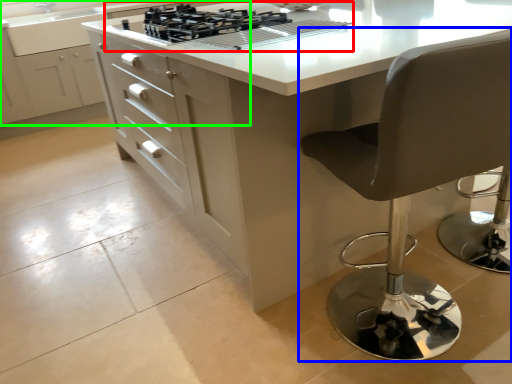
Question: Estimate the real-world distances between objects in this image. Which object is farther from gas stove (highlighted by a red box), chair (highlighted by a blue box) or cabinetry (highlighted by a green box)?

Choices:
 (A) chair
 (B) cabinetry

Answer: (B)